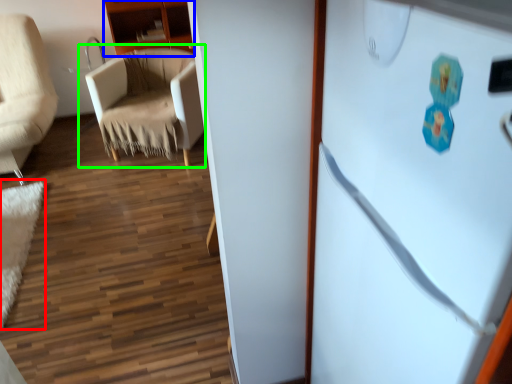
Question: Which object is the closest to the mat (highlighted by a red box)? Choose among these: cabinetry (highlighted by a blue box) or chair (highlighted by a green box).

Choices:
 (A) cabinetry
 (B) chair

Answer: (B)